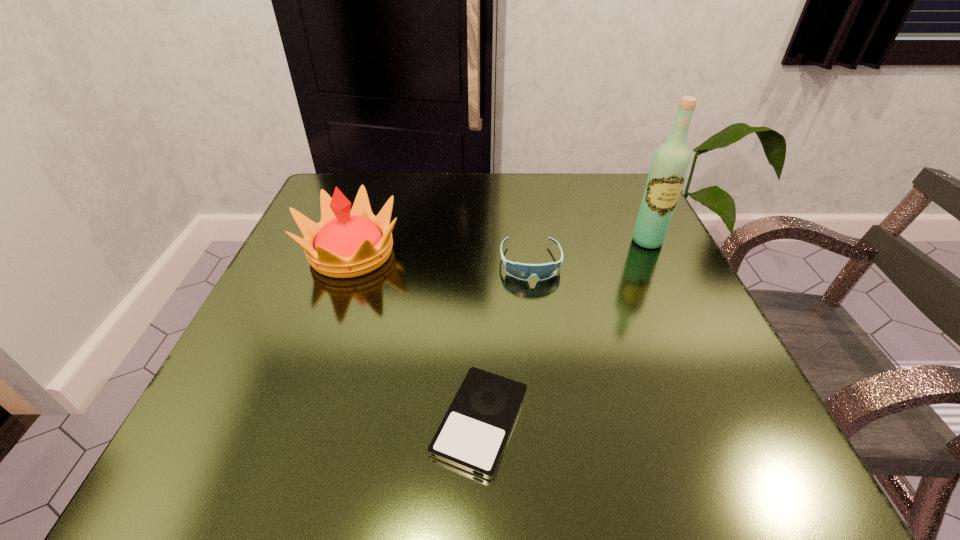
Where is `free space located 0.240m on the back of the nearest object`? The width and height of the screenshot is (960, 540). free space located 0.240m on the back of the nearest object is located at coordinates (480, 269).

Identify the location of object that is at the far edge. (346, 243).

Find the location of a particular element. object at the near edge is located at coordinates (473, 434).

Where is `object located at the left edge`? The image size is (960, 540). object located at the left edge is located at coordinates (346, 243).

At what (x,y) coordinates should I click in order to perform the action: click on object located in the right edge section of the desktop. Please return your answer as a coordinate pair (x, y). Looking at the image, I should click on (669, 167).

What are the coordinates of `object that is positioned at the far left corner` in the screenshot? It's located at (346, 243).

Find the location of a particular element. The width and height of the screenshot is (960, 540). vacant space at the far edge of the desktop is located at coordinates (530, 181).

This screenshot has width=960, height=540. In the image, there is a desktop. What are the coordinates of `free space at the right edge` in the screenshot? It's located at (702, 354).

You are a GUI agent. You are given a task and a screenshot of the screen. Output one action in this format:
    pyautogui.click(x=<x>, y=<y>)
    Task: Click on the vacant space at the far left corner of the desktop
    The height and width of the screenshot is (540, 960).
    Given the screenshot: What is the action you would take?
    pyautogui.click(x=378, y=175)

You are a GUI agent. You are given a task and a screenshot of the screen. Output one action in this format:
    pyautogui.click(x=<x>, y=<y>)
    Task: Click on the free space at the near left corner of the desktop
    The width and height of the screenshot is (960, 540).
    Given the screenshot: What is the action you would take?
    pyautogui.click(x=229, y=442)